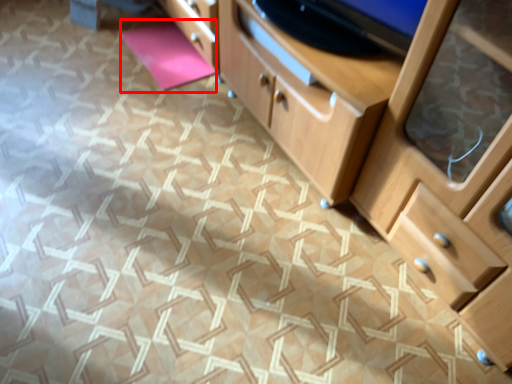
Question: From the image, what is the correct spatial relationship of yoga mat (annotated by the red box) in relation to chest of drawers?

Choices:
 (A) left
 (B) right

Answer: (A)